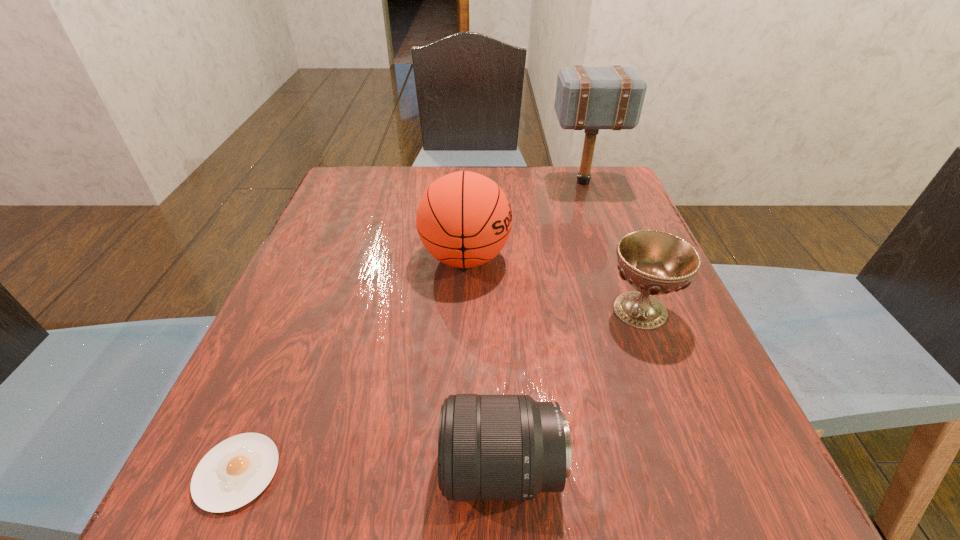
Identify the location of object that can be found as the fourth closest to the telephoto lens. (591, 98).

Point out which object is positioned as the fourth nearest to the shortest object. Please provide its 2D coordinates. Your answer should be formatted as a tuple, i.e. [(x, y)], where the tuple contains the x and y coordinates of a point satisfying the conditions above.

[(591, 98)]

Where is `free spot that satisfies the following two spatial constraints: 1. on the striking surface of the chalice; 2. on the right side of the tallest object`? This screenshot has height=540, width=960. free spot that satisfies the following two spatial constraints: 1. on the striking surface of the chalice; 2. on the right side of the tallest object is located at coordinates (630, 310).

Locate an element on the screen. vacant region that satisfies the following two spatial constraints: 1. on the back side of the chalice; 2. on the striking surface of the farthest object is located at coordinates (591, 182).

Identify the location of free location that satisfies the following two spatial constraints: 1. on the striking surface of the chalice; 2. on the right side of the mallet. (630, 310).

Locate an element on the screen. The width and height of the screenshot is (960, 540). free location that satisfies the following two spatial constraints: 1. on the side with logo of the fourth shortest object; 2. on the left side of the chalice is located at coordinates (464, 310).

Find the location of `free point that satisfies the following two spatial constraints: 1. on the back side of the chalice; 2. on the side with logo of the basketball`. free point that satisfies the following two spatial constraints: 1. on the back side of the chalice; 2. on the side with logo of the basketball is located at coordinates (620, 258).

Locate an element on the screen. Image resolution: width=960 pixels, height=540 pixels. vacant position in the image that satisfies the following two spatial constraints: 1. on the side with logo of the second tallest object; 2. on the right side of the chalice is located at coordinates (464, 310).

Where is `vacant area in the image that satisfies the following two spatial constraints: 1. on the side with logo of the chalice; 2. on the right side of the fourth shortest object`? Image resolution: width=960 pixels, height=540 pixels. vacant area in the image that satisfies the following two spatial constraints: 1. on the side with logo of the chalice; 2. on the right side of the fourth shortest object is located at coordinates (464, 310).